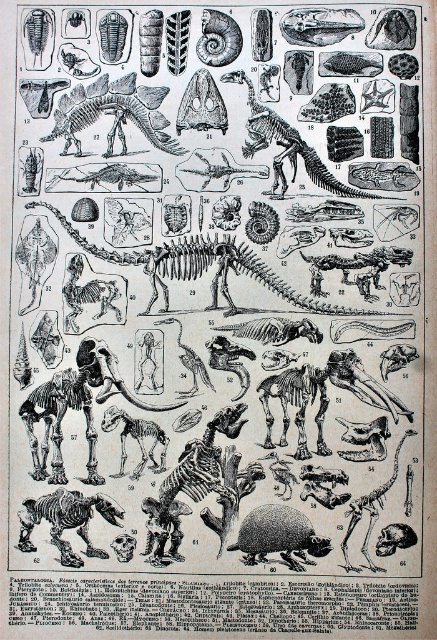
You are examining the illustration and want to determine which of the two points, point (287, 522) or point (319, 161), is nearer to you. Based on the illustration, which point is closer?

Point (287, 522) is closer to the viewer than point (319, 161).

In the image, there are two central objects labeled as the brown textured armadillo at center and the smooth bone dinosaur at center. From the perspective of someone looking at the image, which one is positioned to the left?

The brown textured armadillo at center is to the left of the smooth bone dinosaur at center.

Looking at the image, there are two central objects labeled as the smooth gray skull at center and the smooth bone dinosaur at center. Which of these two objects is taller?

The smooth gray skull at center is not as tall as the smooth bone dinosaur at center, so the smooth bone dinosaur at center is taller.